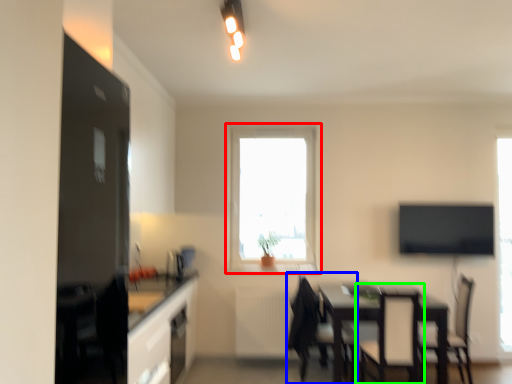
Question: Which is farther away from window (highlighted by a red box)? chair (highlighted by a blue box) or armchair (highlighted by a green box)?

Choices:
 (A) chair
 (B) armchair

Answer: (B)